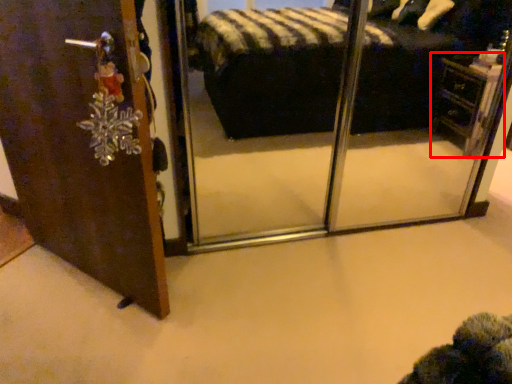
Question: Observing the image, what is the correct spatial positioning of vanity (annotated by the red box) in reference to door?

Choices:
 (A) left
 (B) right

Answer: (B)